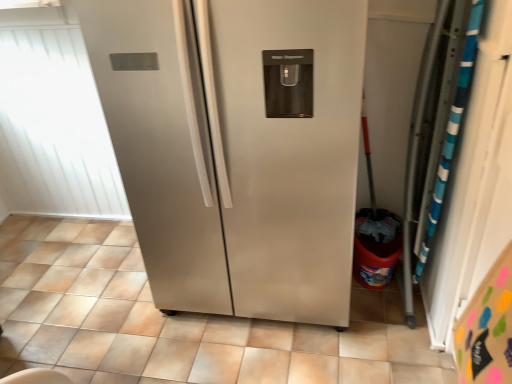
What do you see at coordinates (54, 128) in the screenshot?
I see `white matte window screen at upper left` at bounding box center [54, 128].

Locate an element on the screen. white matte window screen at upper left is located at coordinates (54, 128).

At what (x,y) coordinates should I click in order to perform the action: click on satin silver refrigerator at center. Please return your answer as a coordinate pair (x, y). This screenshot has width=512, height=384. Looking at the image, I should click on (179, 321).

What do you see at coordinates (179, 321) in the screenshot?
I see `satin silver refrigerator at center` at bounding box center [179, 321].

I want to click on white matte window screen at upper left, so click(x=54, y=128).

Is white matte window screen at upper left to the left of satin silver refrigerator at center from the viewer's perspective?

Correct, you'll find white matte window screen at upper left to the left of satin silver refrigerator at center.

Which object is further away from the camera, white matte window screen at upper left or satin silver refrigerator at center?

white matte window screen at upper left is behind.

Which is in front, point (62, 153) or point (97, 262)?

Positioned in front is point (97, 262).

From the image's perspective, between white matte window screen at upper left and satin silver refrigerator at center, who is located below?

satin silver refrigerator at center, from the image's perspective.

From a real-world perspective, is white matte window screen at upper left beneath satin silver refrigerator at center?

No.

Can you confirm if white matte window screen at upper left is wider than satin silver refrigerator at center?

No, white matte window screen at upper left is not wider than satin silver refrigerator at center.

Between white matte window screen at upper left and satin silver refrigerator at center, which one has less height?

Standing shorter between the two is satin silver refrigerator at center.

Can you confirm if white matte window screen at upper left is smaller than satin silver refrigerator at center?

No, white matte window screen at upper left is not smaller than satin silver refrigerator at center.

In the scene shown: Does white matte window screen at upper left contain satin silver refrigerator at center?

That's incorrect, satin silver refrigerator at center is not inside white matte window screen at upper left.

In the scene shown: Would you say white matte window screen at upper left is a long distance from satin silver refrigerator at center?

No, white matte window screen at upper left is in close proximity to satin silver refrigerator at center.

Is white matte window screen at upper left positioned with its back to satin silver refrigerator at center?

white matte window screen at upper left does not have its back to satin silver refrigerator at center.

How many degrees apart are the facing directions of white matte window screen at upper left and satin silver refrigerator at center?

They differ by 90.8 degrees in their facing directions.

This screenshot has width=512, height=384. Identify the location of window screen located behind the satin silver refrigerator at center. tap(54, 128).

Visually, is satin silver refrigerator at center positioned to the left or to the right of white matte window screen at upper left?

Based on their positions, satin silver refrigerator at center is located to the right of white matte window screen at upper left.

Is the position of satin silver refrigerator at center less distant than that of white matte window screen at upper left?

Yes, satin silver refrigerator at center is closer to the camera.

Is point (393, 307) closer or farther from the camera than point (6, 150)?

Point (393, 307) is closer to the camera than point (6, 150).

Based on the photo, from the image's perspective, is satin silver refrigerator at center positioned above or below white matte window screen at upper left?

Based on their image positions, satin silver refrigerator at center is located beneath white matte window screen at upper left.

From a real-world perspective, who is located higher, satin silver refrigerator at center or white matte window screen at upper left?

white matte window screen at upper left, from a real-world perspective.

Considering the sizes of satin silver refrigerator at center and white matte window screen at upper left in the image, is satin silver refrigerator at center wider or thinner than white matte window screen at upper left?

Clearly, satin silver refrigerator at center has more width compared to white matte window screen at upper left.

Between satin silver refrigerator at center and white matte window screen at upper left, which one has more height?

With more height is white matte window screen at upper left.

Who is bigger, satin silver refrigerator at center or white matte window screen at upper left?

With larger size is white matte window screen at upper left.

Is satin silver refrigerator at center positioned beyond the bounds of white matte window screen at upper left?

That's correct, satin silver refrigerator at center is outside of white matte window screen at upper left.

Would you say satin silver refrigerator at center is a long distance from white matte window screen at upper left?

That's not correct — satin silver refrigerator at center is a little close to white matte window screen at upper left.

Is satin silver refrigerator at center positioned with its back to white matte window screen at upper left?

No.

Find the location of a particular element. This screenshot has width=512, height=384. window screen lying above the satin silver refrigerator at center (from the image's perspective) is located at coordinates (54, 128).

In the image, there is a satin silver refrigerator at center. Find the location of `window screen above it (from the image's perspective)`. window screen above it (from the image's perspective) is located at coordinates (54, 128).

Locate an element on the screen. tile on the right of white matte window screen at upper left is located at coordinates (179, 321).